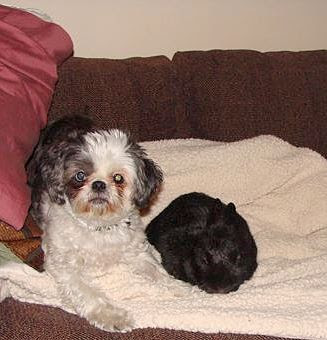
At what (x,y) coordinates should I click in order to perform the action: click on wall. Please return your answer as a coordinate pair (x, y). Looking at the image, I should click on (251, 15).